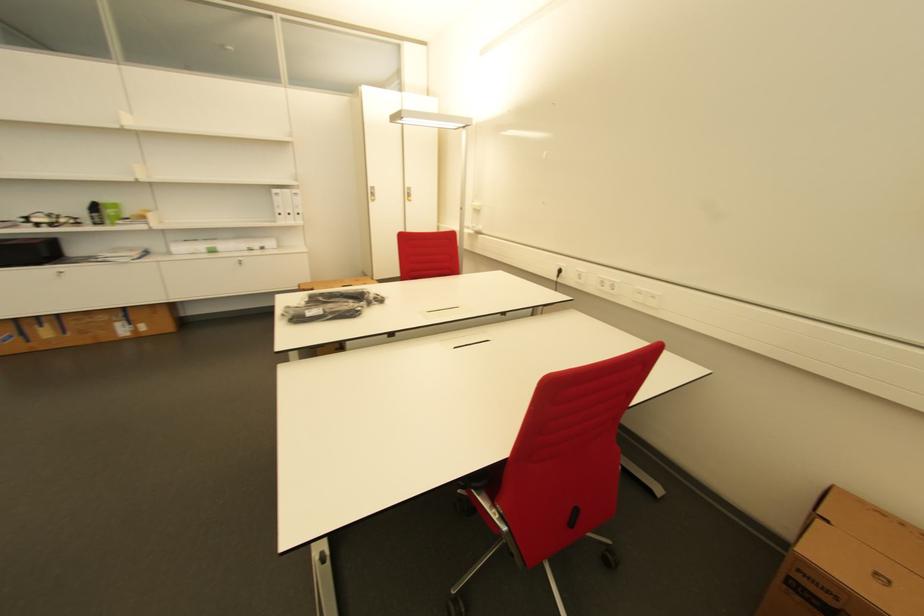
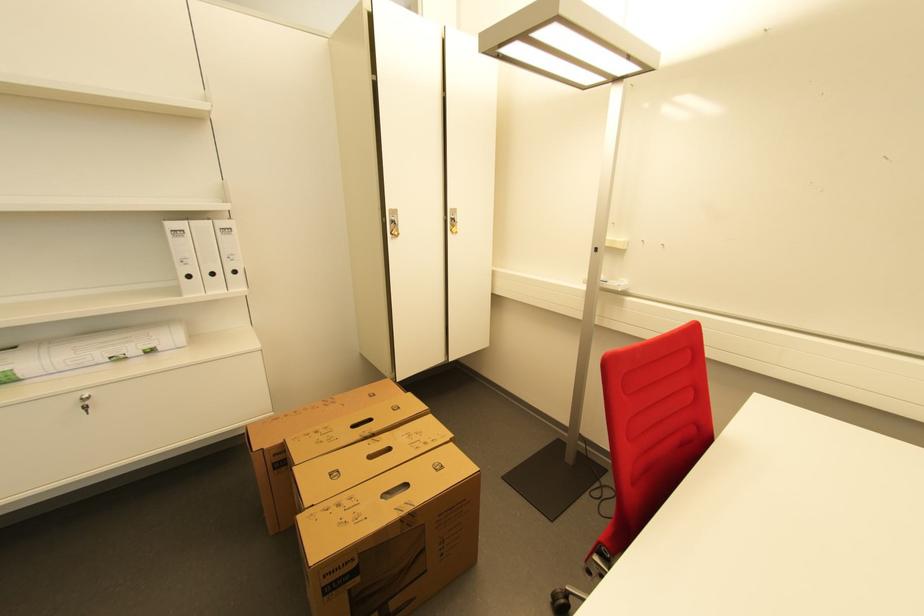
Where in the second image is the point corresponding to pixel 268 249 from the first image?

(155, 352)